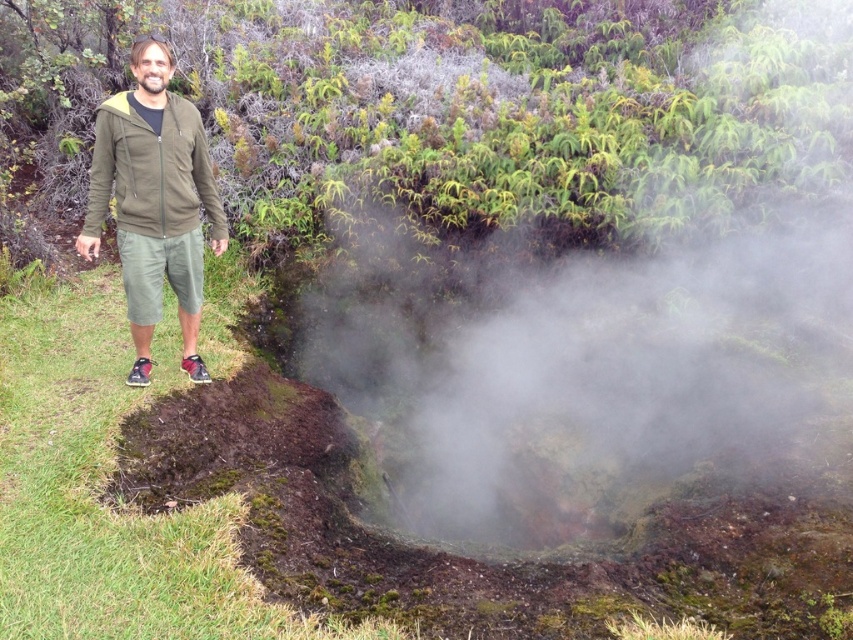
Is white misty steam at center to the right of matte olive green jacket at left from the viewer's perspective?

Indeed, white misty steam at center is positioned on the right side of matte olive green jacket at left.

Is white misty steam at center bigger than matte olive green jacket at left?

Yes, white misty steam at center is bigger than matte olive green jacket at left.

This screenshot has width=853, height=640. In order to click on white misty steam at center in this screenshot , I will do `click(602, 292)`.

Is point (520, 349) behind point (112, 179)?

Yes, point (520, 349) is farther from viewer.

Measure the distance between white misty steam at center and camera.

The distance of white misty steam at center from camera is 4.29 meters.

Who is more distant from viewer, (851, 160) or (189, 186)?

The point (851, 160) is behind.

At what (x,y) coordinates should I click in order to perform the action: click on white misty steam at center. Please return your answer as a coordinate pair (x, y). This screenshot has width=853, height=640. Looking at the image, I should click on pos(602,292).

Who is positioned more to the left, green matte jacket at left or matte olive green jacket at left?

Positioned to the left is matte olive green jacket at left.

Does green matte jacket at left lie behind matte olive green jacket at left?

That is False.

Which is behind, point (189, 173) or point (173, 157)?

The point (189, 173) is behind.

Find the location of a particular element. This screenshot has width=853, height=640. green matte jacket at left is located at coordinates (154, 202).